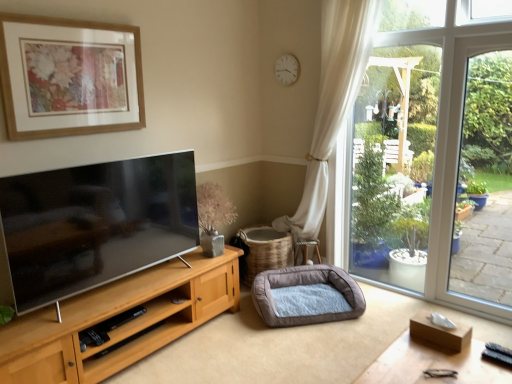
The width and height of the screenshot is (512, 384). I want to click on free space in front of soft gray fabric dog bed at lower center, so click(x=309, y=345).